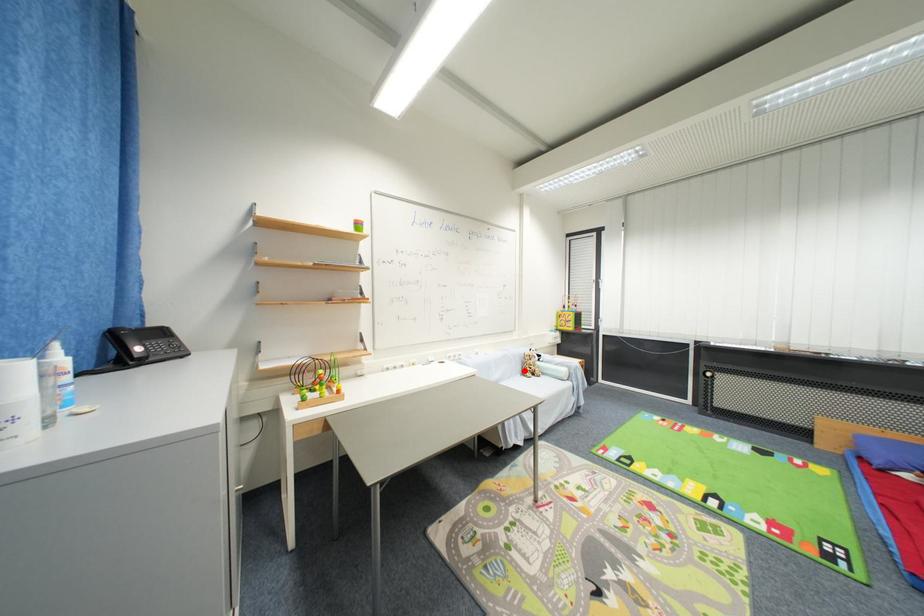
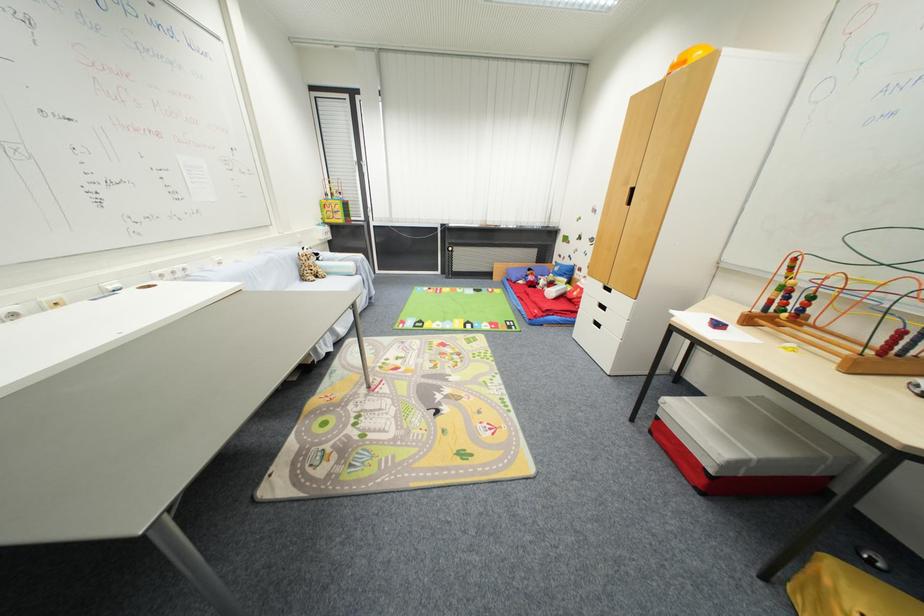
Where in the second image is the point corresponding to the highlighted location from the first image?

(300, 276)